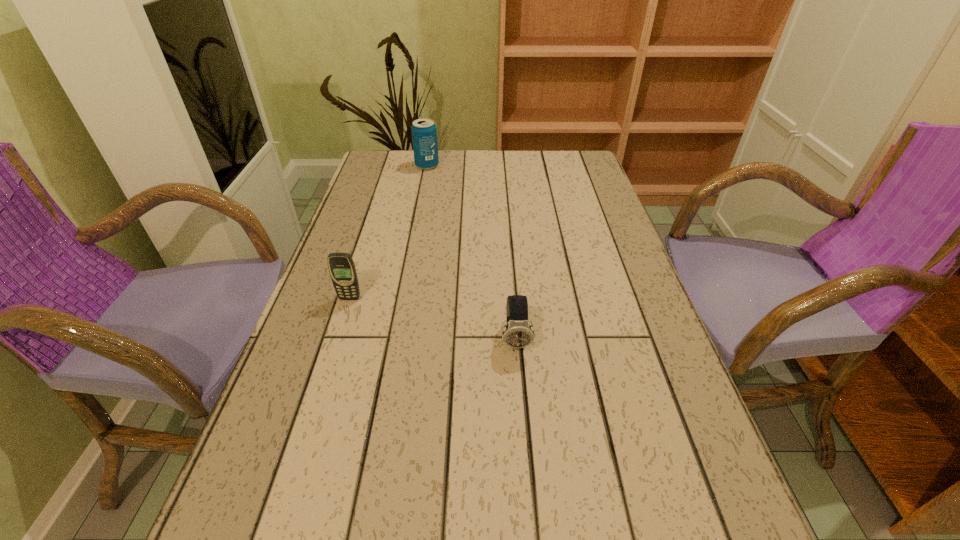
Locate an element on the screen. free space between the second farthest object and the second object from right to left is located at coordinates (389, 232).

Find the location of a particular element. The image size is (960, 540). free space that is in between the leftmost object and the nearest object is located at coordinates (433, 319).

Identify which object is the closest to the cellular telephone. Please provide its 2D coordinates. Your answer should be formatted as a tuple, i.e. [(x, y)], where the tuple contains the x and y coordinates of a point satisfying the conditions above.

[(517, 334)]

Locate which object is the second closest to the tallest object. Please provide its 2D coordinates. Your answer should be formatted as a tuple, i.e. [(x, y)], where the tuple contains the x and y coordinates of a point satisfying the conditions above.

[(517, 334)]